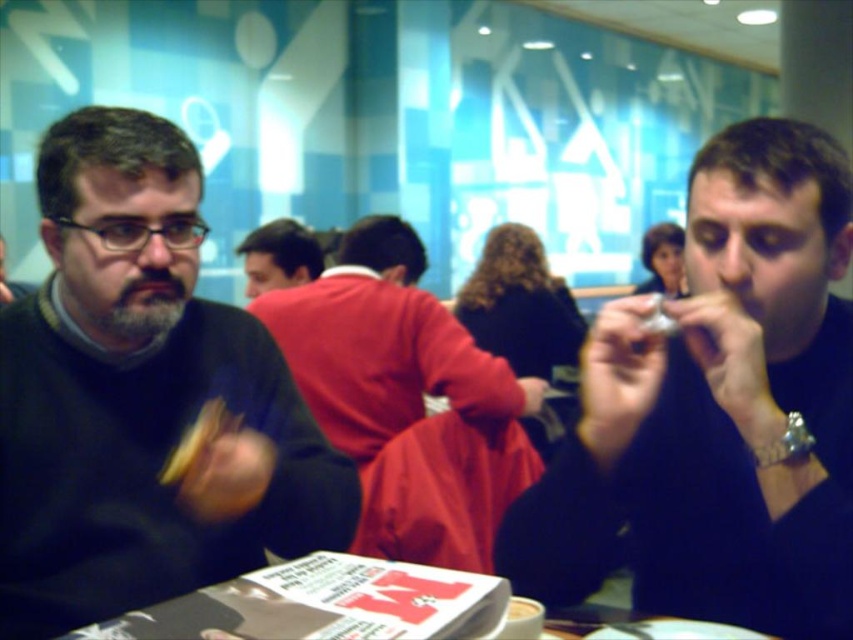
Question: Does black matte shirt at right have a smaller size compared to white glossy table at lower center?

Choices:
 (A) yes
 (B) no

Answer: (B)

Question: Which point is closer to the camera?

Choices:
 (A) (305, 621)
 (B) (288, 232)
 (C) (144, 353)

Answer: (A)

Question: Does black matte shirt at right have a lesser width compared to red sweater at center?

Choices:
 (A) no
 (B) yes

Answer: (A)

Question: Which of the following is the closest to the observer?

Choices:
 (A) white glossy table at lower center
 (B) black matte shirt at right
 (C) matte black sweater at left

Answer: (A)

Question: Where is black matte shirt at right located in relation to red sweater at center in the image?

Choices:
 (A) above
 (B) below

Answer: (B)

Question: Which of the following is the farthest from the observer?

Choices:
 (A) (215, 440)
 (B) (831, 580)
 (C) (305, 256)

Answer: (C)